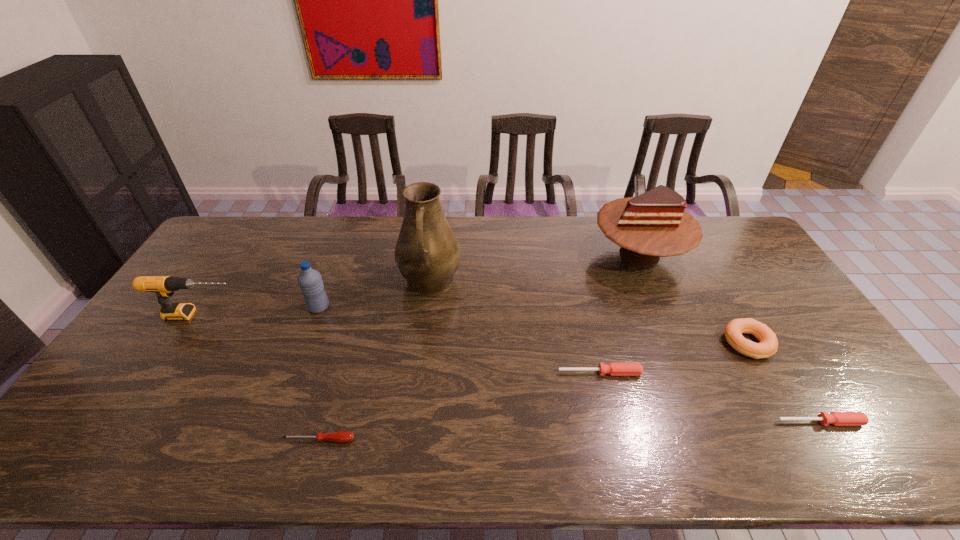
Locate an element on the screen. This screenshot has width=960, height=540. blank space located 0.330m on the left of the second nearest screwdriver is located at coordinates (644, 422).

At what (x,y) coordinates should I click in order to perform the action: click on free space located 0.220m on the left of the nearest object. Please return your answer as a coordinate pair (x, y). This screenshot has height=540, width=960. Looking at the image, I should click on (191, 440).

What are the coordinates of `object present at the far edge` in the screenshot? It's located at (654, 224).

The width and height of the screenshot is (960, 540). I want to click on object present at the near edge, so click(341, 436).

Locate an element on the screen. This screenshot has height=540, width=960. object located in the left edge section of the desktop is located at coordinates (163, 286).

This screenshot has height=540, width=960. I want to click on bagel at the right edge, so click(x=733, y=331).

Locate an element on the screen. The width and height of the screenshot is (960, 540). screwdriver at the right edge is located at coordinates (835, 418).

Identify the location of blank space at the far edge. (396, 235).

In the image, there is a desktop. At what (x,y) coordinates should I click in order to perform the action: click on free space at the near edge. Please return your answer as a coordinate pair (x, y). This screenshot has width=960, height=540. Looking at the image, I should click on (409, 464).

Locate an element on the screen. free spot at the left edge of the desktop is located at coordinates (127, 422).